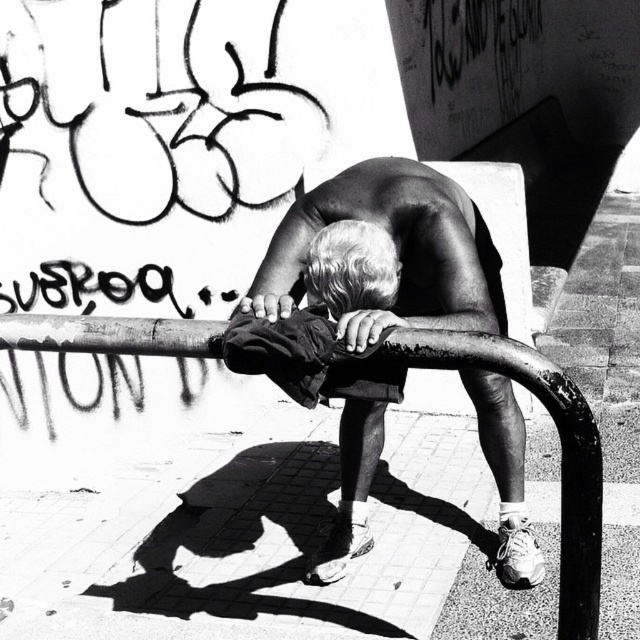
Question: Where is rusty metal rail at center located in relation to black graffiti at upper left in the image?

Choices:
 (A) below
 (B) above

Answer: (A)

Question: Which point is farther from the camera taking this photo?

Choices:
 (A) (161, 269)
 (B) (557, 637)

Answer: (A)

Question: Based on their relative distances, which object is nearer to the black graffiti at upper left?

Choices:
 (A) dark fabric shorts at center
 (B) rusty metal rail at center
 (C) smooth skin man at center

Answer: (C)

Question: Does dark fabric shorts at center have a smaller size compared to black graffiti at upper left?

Choices:
 (A) yes
 (B) no

Answer: (B)

Question: Does smooth skin man at center have a larger size compared to dark fabric shorts at center?

Choices:
 (A) yes
 (B) no

Answer: (A)

Question: Among these points, which one is nearest to the camera?

Choices:
 (A) (230, 356)
 (B) (474, 348)
 (C) (349, 296)

Answer: (B)